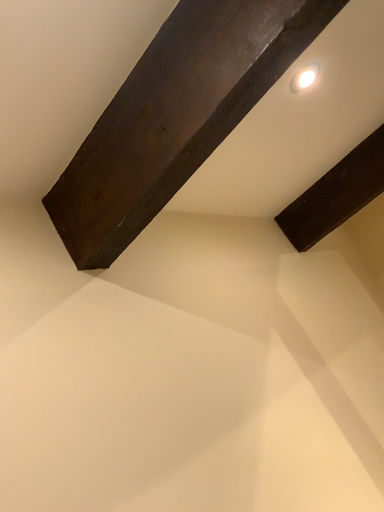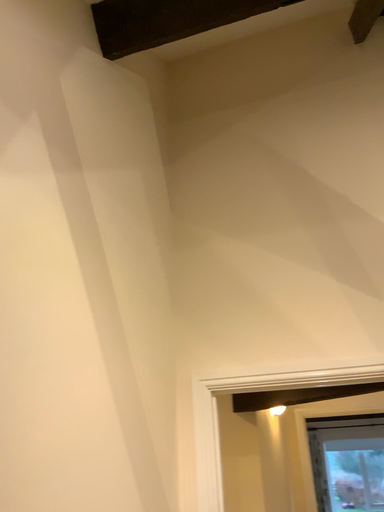
Question: How did the camera likely rotate when shooting the video?

Choices:
 (A) rotated left
 (B) rotated right

Answer: (B)